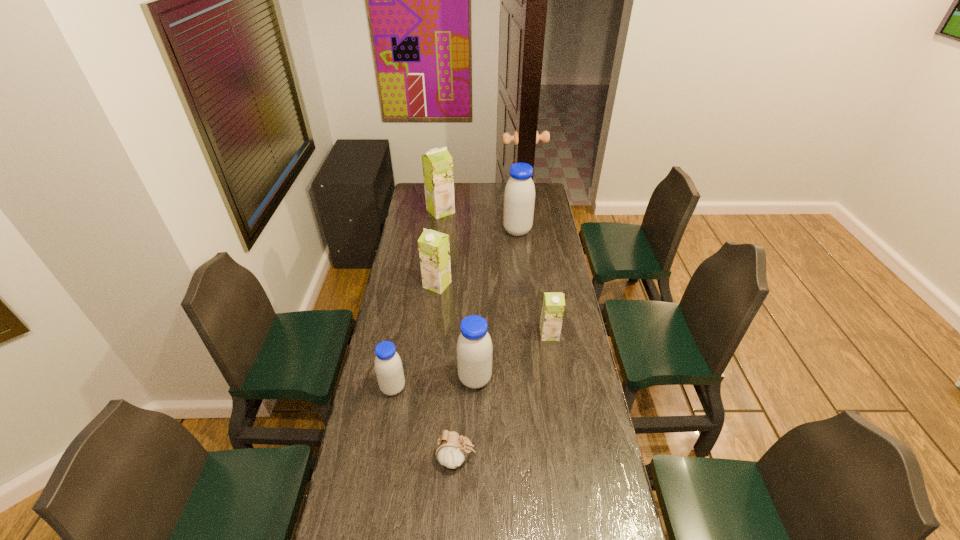
Where is `the leftmost blue soya milk`? The height and width of the screenshot is (540, 960). the leftmost blue soya milk is located at coordinates (388, 366).

Image resolution: width=960 pixels, height=540 pixels. Find the location of `the shortest object`. the shortest object is located at coordinates (452, 449).

Image resolution: width=960 pixels, height=540 pixels. Identify the location of pouch. (452, 449).

Identify the location of free region located 0.370m on the front of the farthest green soya milk. (435, 261).

The width and height of the screenshot is (960, 540). I want to click on free space located on the front of the sixth nearest object, so click(x=519, y=249).

This screenshot has width=960, height=540. In order to click on free space located on the back of the second biggest green soya milk in this screenshot , I will do `click(444, 231)`.

Where is `free region located on the back of the fourth soya milk from left to right`? The image size is (960, 540). free region located on the back of the fourth soya milk from left to right is located at coordinates (475, 347).

The width and height of the screenshot is (960, 540). In order to click on vacant position located 0.070m on the left of the fourth farthest object in this screenshot , I will do `click(523, 334)`.

Locate an element on the screen. free space located on the back of the smallest blue soya milk is located at coordinates (405, 318).

Where is `free space located 0.050m on the front-facing side of the white pouch`? free space located 0.050m on the front-facing side of the white pouch is located at coordinates (492, 458).